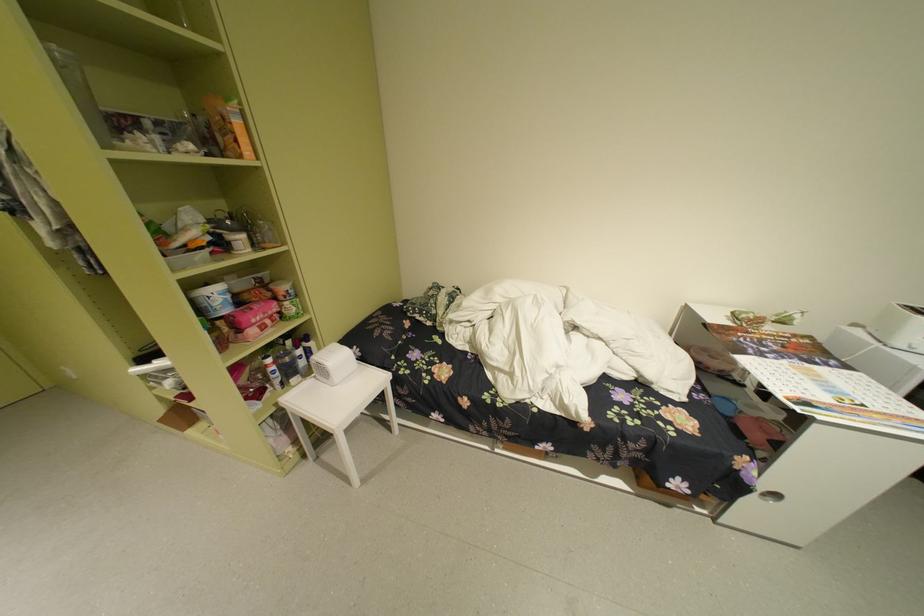
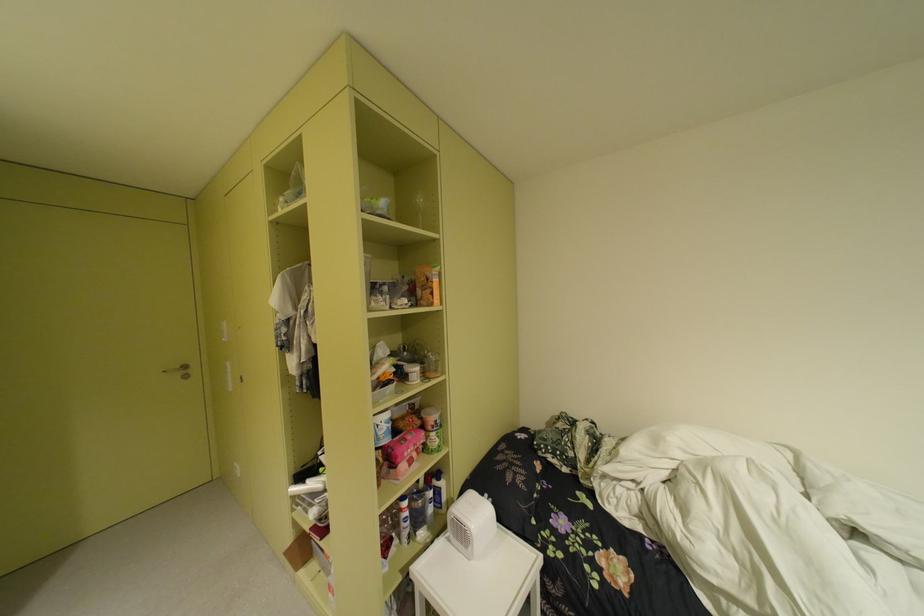
The point at [201,146] is marked in the first image. Where is the corresponding point in the second image?

(417, 301)